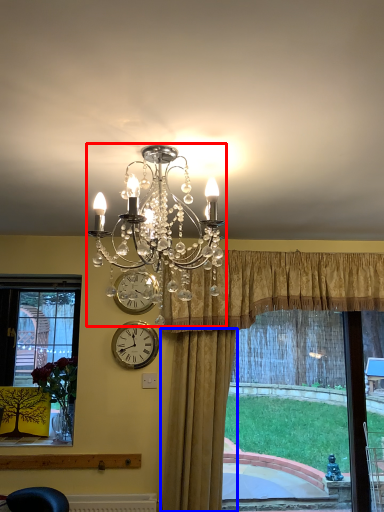
Question: Which of the following is the closest to the observer, lamp (highlighted by a red box) or curtain (highlighted by a blue box)?

Choices:
 (A) lamp
 (B) curtain

Answer: (A)